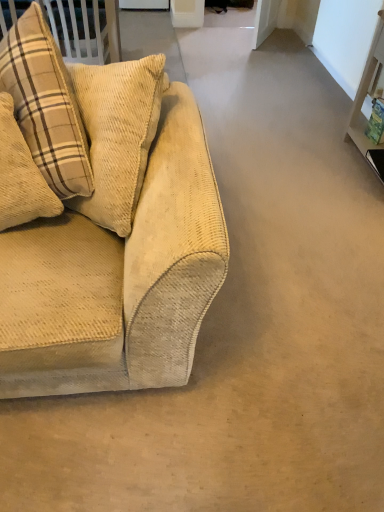
Question: Does beige corduroy couch at left appear on the left side of beige corduroy pillow at left?

Choices:
 (A) no
 (B) yes

Answer: (A)

Question: Does beige corduroy couch at left have a smaller size compared to beige corduroy pillow at left?

Choices:
 (A) no
 (B) yes

Answer: (A)

Question: Is beige corduroy couch at left not near beige corduroy pillow at left?

Choices:
 (A) no
 (B) yes

Answer: (A)

Question: Is the position of beige corduroy couch at left more distant than that of beige corduroy pillow at left?

Choices:
 (A) no
 (B) yes

Answer: (A)

Question: Is beige corduroy couch at left directly adjacent to beige corduroy pillow at left?

Choices:
 (A) yes
 (B) no

Answer: (B)

Question: From the image's perspective, does beige corduroy couch at left appear higher than beige corduroy pillow at left?

Choices:
 (A) yes
 (B) no

Answer: (A)

Question: Does beige corduroy pillow at left have a lesser height compared to beige corduroy couch at left?

Choices:
 (A) yes
 (B) no

Answer: (A)

Question: Does beige corduroy pillow at left have a greater height compared to beige corduroy couch at left?

Choices:
 (A) no
 (B) yes

Answer: (A)

Question: From the image's perspective, is beige corduroy pillow at left on top of beige corduroy couch at left?

Choices:
 (A) yes
 (B) no

Answer: (B)

Question: Considering the relative sizes of beige corduroy pillow at left and beige corduroy couch at left in the image provided, is beige corduroy pillow at left smaller than beige corduroy couch at left?

Choices:
 (A) no
 (B) yes

Answer: (B)

Question: Would you say beige corduroy pillow at left is outside beige corduroy couch at left?

Choices:
 (A) no
 (B) yes

Answer: (A)

Question: Does beige corduroy pillow at left have a lesser width compared to beige corduroy couch at left?

Choices:
 (A) no
 (B) yes

Answer: (B)

Question: In terms of width, does beige corduroy pillow at left look wider or thinner when compared to beige corduroy couch at left?

Choices:
 (A) thin
 (B) wide

Answer: (A)